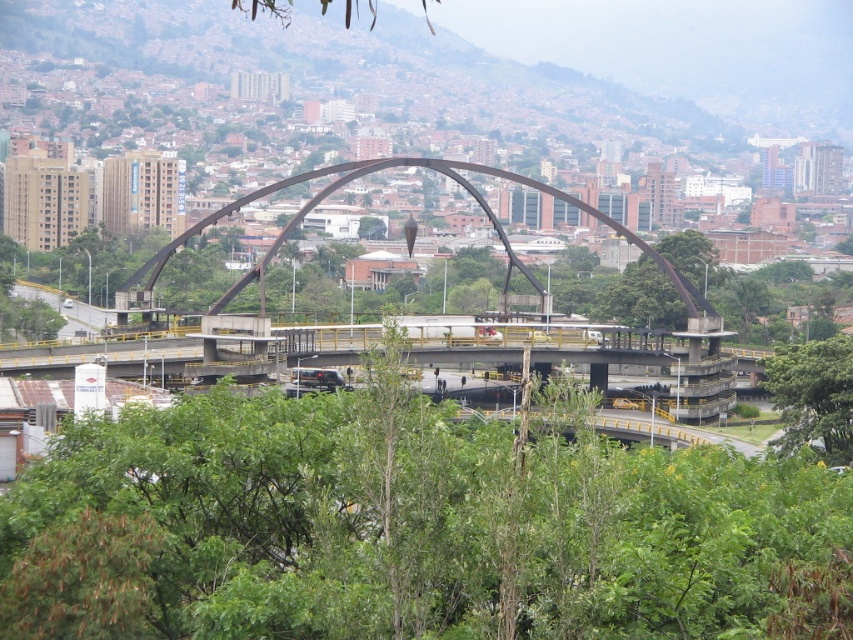
Is point (428, 410) less distant than point (341, 168)?

Yes, point (428, 410) is in front of point (341, 168).

Which is behind, point (706, 541) or point (505, 284)?

The point (505, 284) is behind.

Where is `green leafy tree at center`? green leafy tree at center is located at coordinates (412, 528).

Can you confirm if metallic bridge at center is shorter than green leafy tree at lower right?

In fact, metallic bridge at center may be taller than green leafy tree at lower right.

Can you confirm if metallic bridge at center is positioned to the left of green leafy tree at lower right?

Correct, you'll find metallic bridge at center to the left of green leafy tree at lower right.

Between point (677, 419) and point (843, 376), which one is positioned behind?

Point (677, 419)

At what (x,y) coordinates should I click in order to perform the action: click on metallic bridge at center. Please return your answer as a coordinate pair (x, y). This screenshot has height=640, width=853. Looking at the image, I should click on (480, 209).

Which is more to the right, green leafy tree at center or green leafy tree at lower right?

green leafy tree at lower right is more to the right.

Can you confirm if green leafy tree at center is taller than green leafy tree at lower right?

Yes, green leafy tree at center is taller than green leafy tree at lower right.

Is point (426, 609) in front of point (846, 440)?

That is True.

At what (x,y) coordinates should I click in order to perform the action: click on green leafy tree at center. Please return your answer as a coordinate pair (x, y). Looking at the image, I should click on (412, 528).